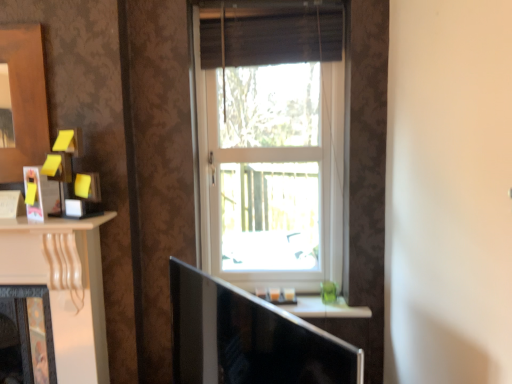
Question: Considering the relative sizes of matte black fireplace at left and white plastic window at center in the image provided, is matte black fireplace at left shorter than white plastic window at center?

Choices:
 (A) yes
 (B) no

Answer: (A)

Question: From a real-world perspective, is matte black fireplace at left physically above white plastic window at center?

Choices:
 (A) no
 (B) yes

Answer: (A)

Question: Considering the relative sizes of matte black fireplace at left and white plastic window at center in the image provided, is matte black fireplace at left thinner than white plastic window at center?

Choices:
 (A) yes
 (B) no

Answer: (B)

Question: Considering the relative sizes of matte black fireplace at left and white plastic window at center in the image provided, is matte black fireplace at left taller than white plastic window at center?

Choices:
 (A) yes
 (B) no

Answer: (B)

Question: Are matte black fireplace at left and white plastic window at center making contact?

Choices:
 (A) yes
 (B) no

Answer: (B)

Question: Considering the relative positions of matte black fireplace at left and white plastic window at center in the image provided, is matte black fireplace at left behind white plastic window at center?

Choices:
 (A) no
 (B) yes

Answer: (A)

Question: Is matte black fireplace at left to the right of matte black picture frame at left from the viewer's perspective?

Choices:
 (A) no
 (B) yes

Answer: (A)

Question: Considering the relative sizes of matte black fireplace at left and matte black picture frame at left in the image provided, is matte black fireplace at left smaller than matte black picture frame at left?

Choices:
 (A) yes
 (B) no

Answer: (B)

Question: Is matte black fireplace at left positioned beyond the bounds of matte black picture frame at left?

Choices:
 (A) yes
 (B) no

Answer: (A)

Question: From the image's perspective, is matte black fireplace at left located beneath matte black picture frame at left?

Choices:
 (A) yes
 (B) no

Answer: (A)

Question: Would you say matte black fireplace at left is a long distance from matte black picture frame at left?

Choices:
 (A) no
 (B) yes

Answer: (A)

Question: From the image's perspective, is matte black fireplace at left above matte black picture frame at left?

Choices:
 (A) no
 (B) yes

Answer: (A)

Question: Is matte black tv at center to the right of white glossy window sill at center from the viewer's perspective?

Choices:
 (A) no
 (B) yes

Answer: (A)